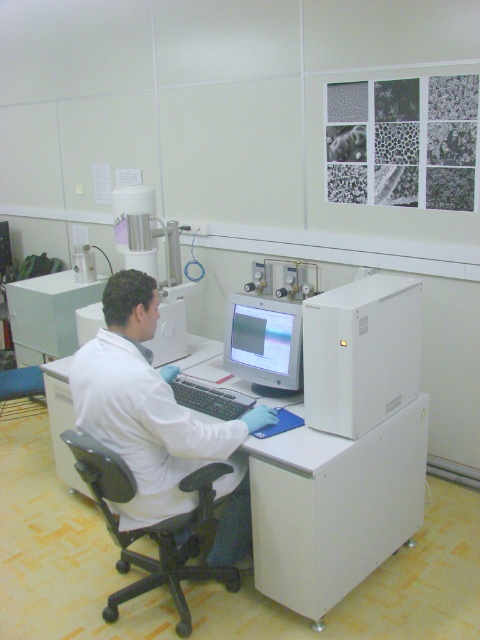
Is white lab coat at center wider than matte gray monitor at center?

Correct, the width of white lab coat at center exceeds that of matte gray monitor at center.

From the picture: Is white lab coat at center thinner than matte gray monitor at center?

Incorrect, white lab coat at center's width is not less than matte gray monitor at center's.

Does point (140, 282) lie behind point (252, 333)?

No, (140, 282) is in front of (252, 333).

At what (x,y) coordinates should I click in order to perform the action: click on white lab coat at center. Please return your answer as a coordinate pair (x, y). This screenshot has width=480, height=640. Looking at the image, I should click on (157, 420).

Does white plastic computer desk at center have a lesser width compared to white matte computer at right?

In fact, white plastic computer desk at center might be wider than white matte computer at right.

Is white plastic computer desk at center positioned before white matte computer at right?

Yes, it is in front of white matte computer at right.

Is point (57, 461) farther from viewer compared to point (308, 419)?

Yes, it is.

The width and height of the screenshot is (480, 640). Identify the location of white plastic computer desk at center. (335, 506).

Can you confirm if white plastic computer desk at center is shorter than white lab coat at center?

Yes.

Does point (415, 406) lie behind point (130, 504)?

Yes, point (415, 406) is behind point (130, 504).

Between point (388, 451) and point (112, 292), which one is positioned in front?

Point (112, 292) is in front.

Image resolution: width=480 pixels, height=640 pixels. What are the coordinates of `white plastic computer desk at center` in the screenshot? It's located at (335, 506).